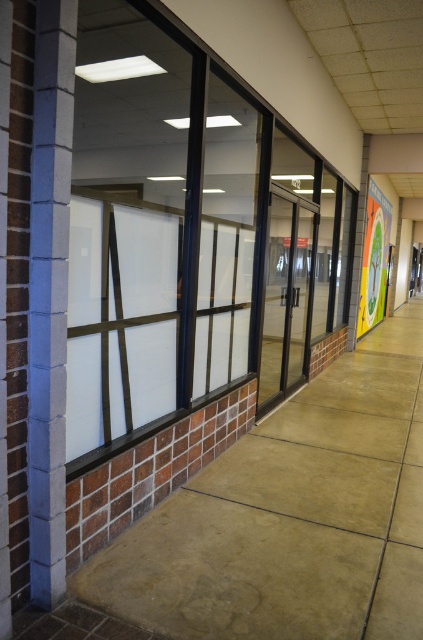
You are a delivery person carrying a large package and need to pass through the hallway. You see the blue brick pillar at left and the transparent glass door at center. Which object is closer to your starting position if you are entering the hallway from the front?

The blue brick pillar at left is closer to your starting position because it is positioned on the left side of the transparent glass door at center, meaning it is nearer to the entrance where you entered the hallway from the front.

Consider the image. You are a painter who needs to move a ladder from the blue brick pillar at left to the transparent glass door at center. Considering their sizes, will the ladder fit through the space between them?

The blue brick pillar at left occupies less space than the transparent glass door at center, so the ladder can fit through the space between them as long as it is narrower than the smaller object, which is the blue brick pillar at left.

You are standing in the hallway and want to pass through the transparent glass door at center. However, there is a blue brick pillar at left in your way. Can you walk around it to reach the door?

The blue brick pillar at left is below the transparent glass door at center, so the pillar is positioned lower than the door. Since the pillar is below the door, it might be part of the floor structure and not blocking your path. Therefore, you can likely walk around or past the blue brick pillar at left to reach the transparent glass door at center.